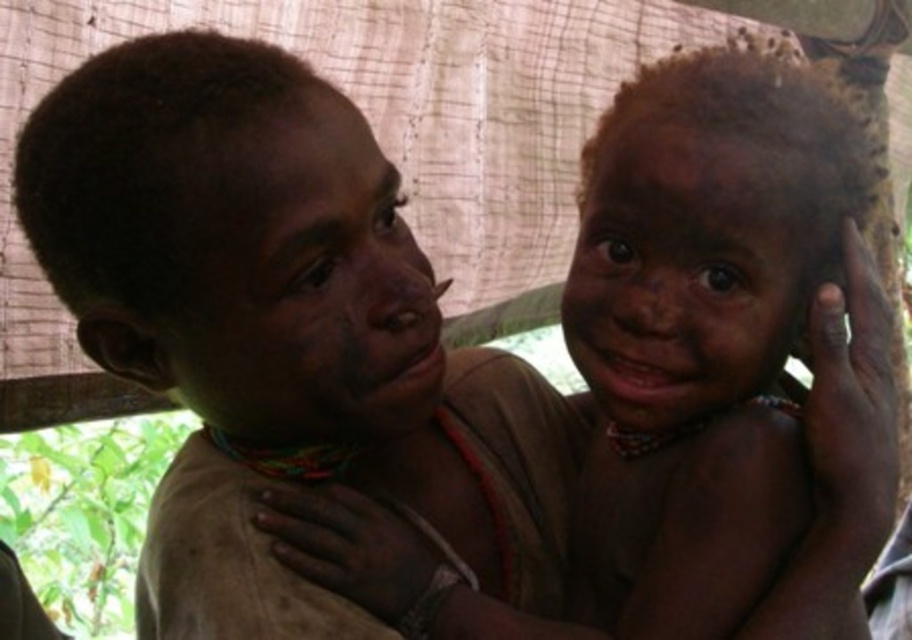
Question: Is dark skin textured face at center to the right of dark skin face at center from the viewer's perspective?

Choices:
 (A) yes
 (B) no

Answer: (B)

Question: Which point is closer to the camera taking this photo?

Choices:
 (A) (612, 177)
 (B) (289, 189)

Answer: (B)

Question: Which object appears farthest from the camera in this image?

Choices:
 (A) dark skin textured face at center
 (B) dark skin face at center

Answer: (B)

Question: Can you confirm if dark skin textured face at center is positioned to the left of dark skin face at center?

Choices:
 (A) yes
 (B) no

Answer: (A)

Question: Among these objects, which one is nearest to the camera?

Choices:
 (A) dark skin face at center
 (B) dark skin textured face at center

Answer: (B)

Question: Is the position of dark skin textured face at center less distant than that of dark skin face at center?

Choices:
 (A) no
 (B) yes

Answer: (B)